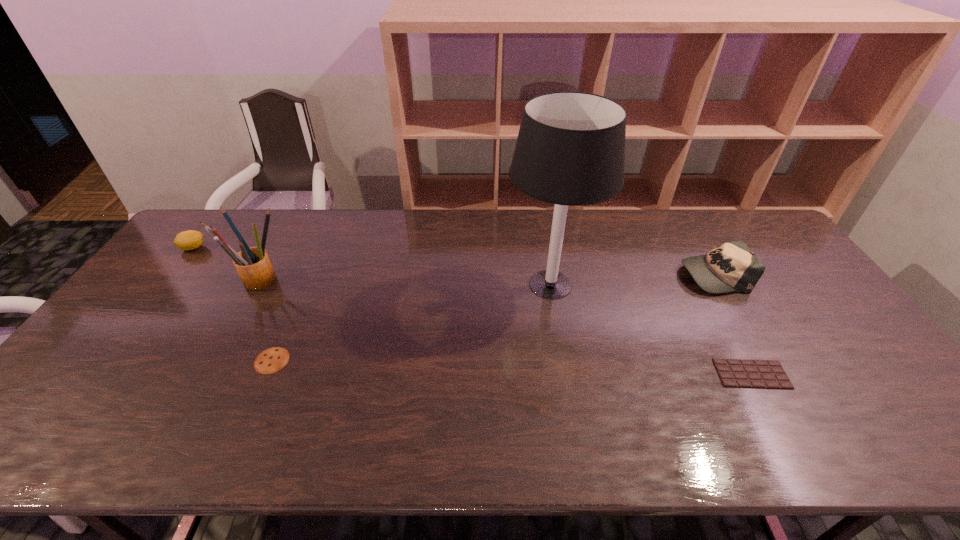
Identify the location of vacant space that is in between the pencil box and the shortest object. (505, 327).

Find the location of `vacant area that lies between the fifth shortest object and the fourth tallest object`. vacant area that lies between the fifth shortest object and the fourth tallest object is located at coordinates (226, 264).

The width and height of the screenshot is (960, 540). What are the coordinates of `empty location between the second tallest object and the cookie` in the screenshot? It's located at (266, 320).

This screenshot has width=960, height=540. I want to click on vacant point located between the third tallest object and the shortest object, so click(x=732, y=324).

Find the location of a particular element. This screenshot has width=960, height=540. empty space between the third shortest object and the shortest object is located at coordinates (472, 311).

This screenshot has height=540, width=960. In order to click on object that stands as the third closest to the shortest object in this screenshot , I will do `click(271, 360)`.

Identify the location of the fourth closest object to the baseball cap. Image resolution: width=960 pixels, height=540 pixels. (253, 265).

Locate an element on the screen. The height and width of the screenshot is (540, 960). vacant space that satisfies the following two spatial constraints: 1. on the front-facing side of the baseball cap; 2. on the front side of the third object from right to left is located at coordinates (720, 285).

The image size is (960, 540). I want to click on free region that satisfies the following two spatial constraints: 1. at the stem end of the lemon; 2. on the right side of the fifth object from right to left, so click(x=168, y=280).

Locate an element on the screen. This screenshot has height=540, width=960. free spot that satisfies the following two spatial constraints: 1. at the stem end of the tallest object; 2. on the left side of the leftmost object is located at coordinates (164, 285).